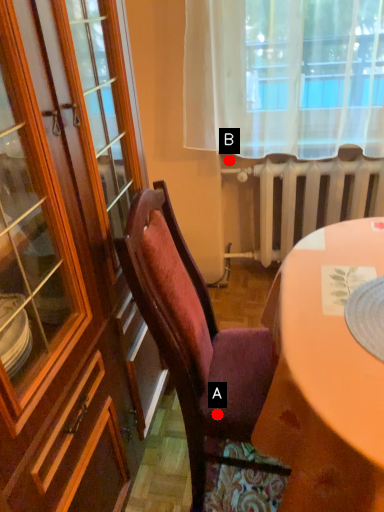
Question: Two points are circled on the image, labeled by A and B beside each circle. Which point is farther from the camera taking this photo?

Choices:
 (A) A is further
 (B) B is further

Answer: (B)